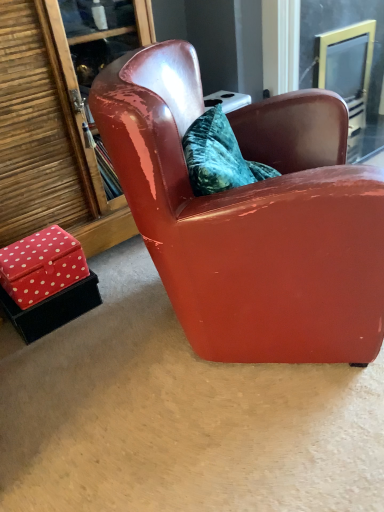
Where is `free space to the left of glossy leather armchair at center`? The image size is (384, 512). free space to the left of glossy leather armchair at center is located at coordinates (92, 355).